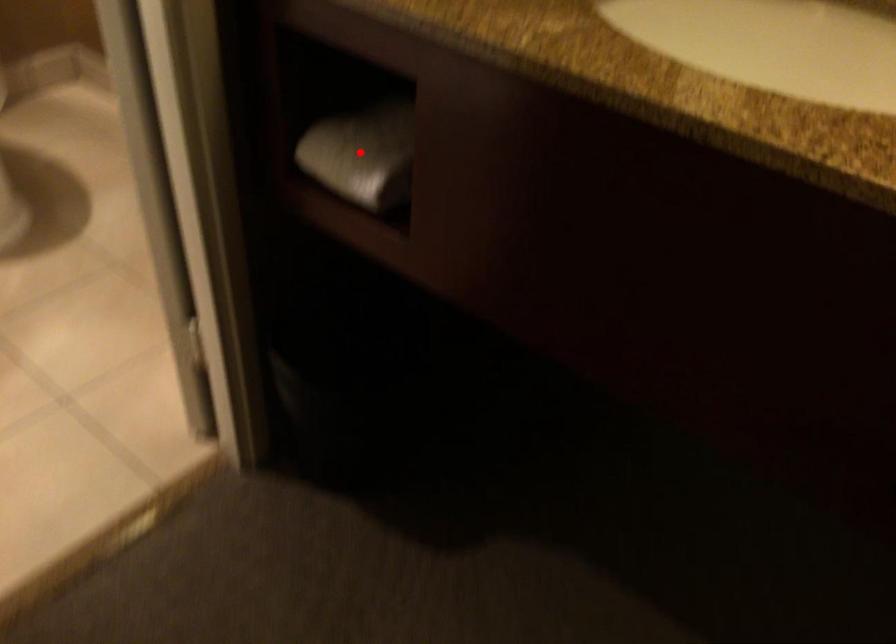
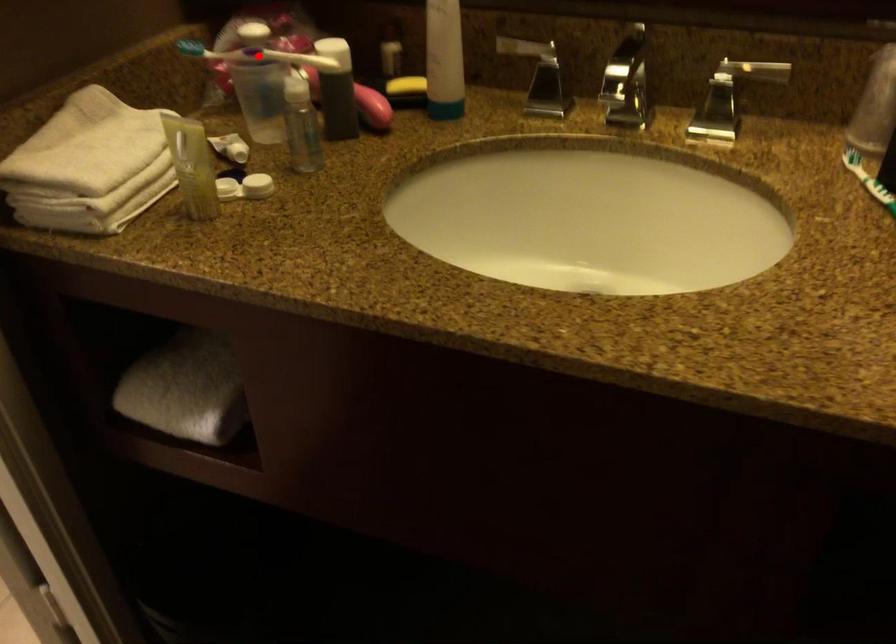
I am providing you with two images of the same scene from different viewpoints. A red point is marked on the first image and another point is marked on the second image. Is the marked point in image1 the same physical position as the marked point in image2?

No